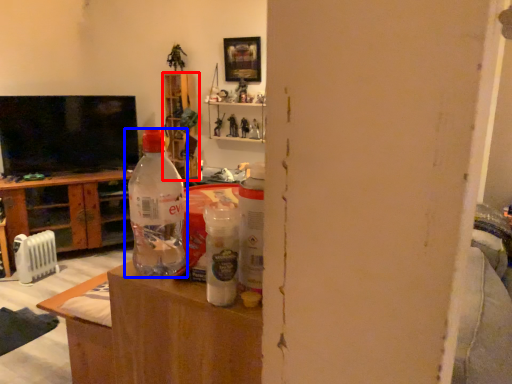
Question: Among these objects, which one is nearest to the camera, shelf (highlighted by a red box) or bottle (highlighted by a blue box)?

Choices:
 (A) shelf
 (B) bottle

Answer: (B)